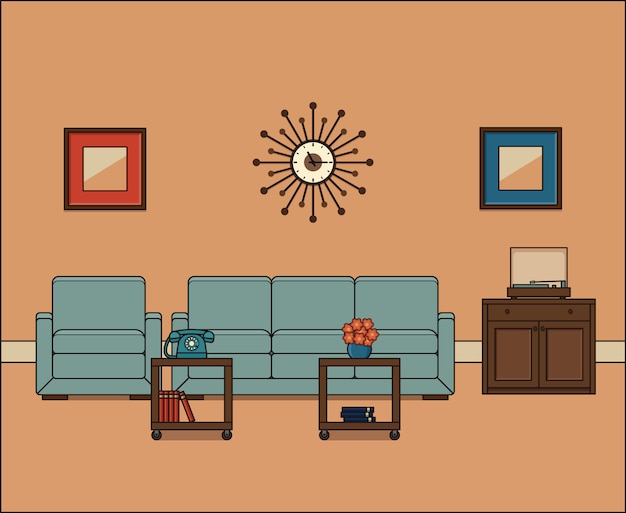
Locate an element on the screen. The height and width of the screenshot is (513, 626). rotary phone is located at coordinates (192, 340).